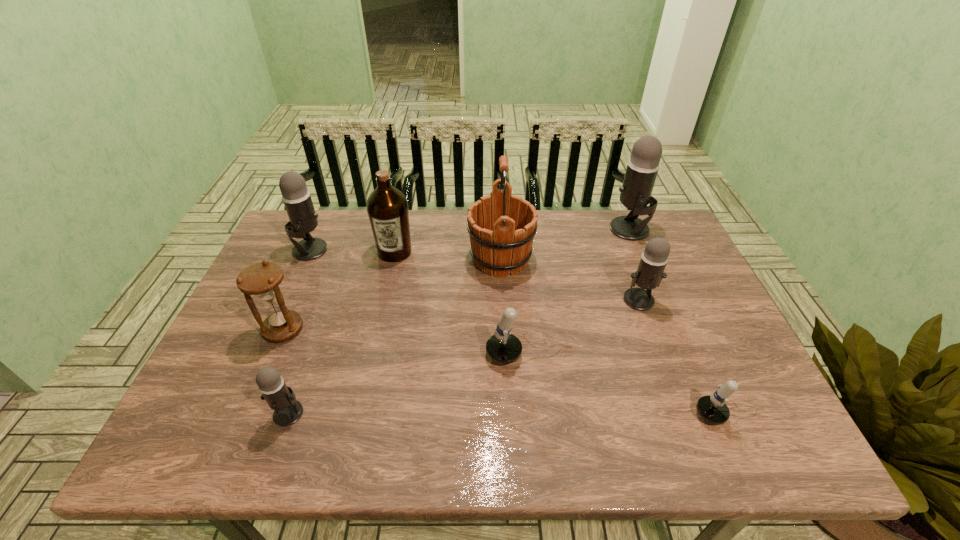
This screenshot has height=540, width=960. I want to click on free space between the nearest gray microphone and the shortest object, so click(511, 414).

The image size is (960, 540). What are the coordinates of `free space between the tallest microphone and the hourglass` in the screenshot? It's located at (457, 279).

You are a GUI agent. You are given a task and a screenshot of the screen. Output one action in this format:
    pyautogui.click(x=<x>, y=<y>)
    Task: Click on the empty space that is in between the smallest gray microphone and the tallest microphone
    The height and width of the screenshot is (540, 960).
    Given the screenshot: What is the action you would take?
    pyautogui.click(x=460, y=321)

Find the location of a particular element. free space between the tallest microphone and the seventh object from right to left is located at coordinates (460, 321).

The height and width of the screenshot is (540, 960). Find the location of `free space between the nearer white microphone and the hourglass`. free space between the nearer white microphone and the hourglass is located at coordinates (508, 372).

The height and width of the screenshot is (540, 960). Find the location of `free point between the right white microphone and the olive oil`. free point between the right white microphone and the olive oil is located at coordinates tap(564, 334).

Locate which object is the fourth closest to the third farthest microphone. Please provide its 2D coordinates. Your answer should be formatted as a tuple, i.e. [(x, y)], where the tuple contains the x and y coordinates of a point satisfying the conditions above.

[(712, 409)]

Locate which object ranks seventh in proximity to the biggest gray microphone. Please provide its 2D coordinates. Your answer should be formatted as a tuple, i.e. [(x, y)], where the tuple contains the x and y coordinates of a point satisfying the conditions above.

[(261, 279)]

Select which microphone appears as the fifth closest to the olive oil. Please provide its 2D coordinates. Your answer should be formatted as a tuple, i.e. [(x, y)], where the tuple contains the x and y coordinates of a point satisfying the conditions above.

[(635, 193)]

Where is `microphone object that ranks as the second closest to the wood wine bucket`? microphone object that ranks as the second closest to the wood wine bucket is located at coordinates (649, 274).